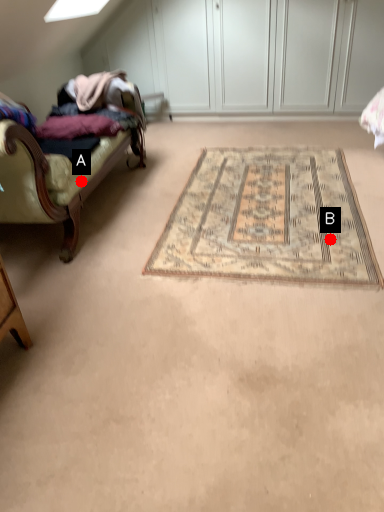
Question: Two points are circled on the image, labeled by A and B beside each circle. Which of the following is the farthest from the observer?

Choices:
 (A) A is further
 (B) B is further

Answer: (A)